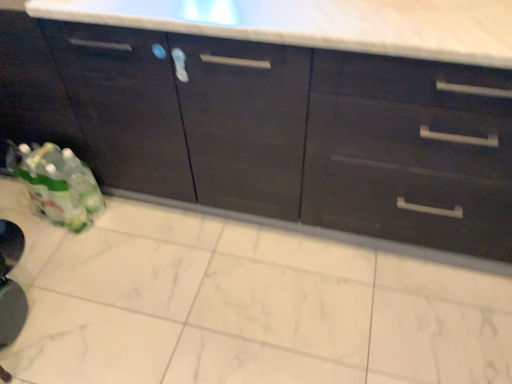
Question: Is point (109, 119) positioned closer to the camera than point (223, 69)?

Choices:
 (A) closer
 (B) farther

Answer: (B)

Question: Relative to matte dark wood cabinets at center, positioned as the second cabinetry in left-to-right order, is matte black cabinet at lower left, which is the first cabinetry from left to right, in front or behind?

Choices:
 (A) behind
 (B) front

Answer: (A)

Question: From a real-world perspective, is matte black cabinet at lower left, which is the second cabinetry from right to left, above or below matte dark wood cabinets at center, positioned as the second cabinetry in left-to-right order?

Choices:
 (A) below
 (B) above

Answer: (B)

Question: From the image's perspective, relative to matte black cabinet at lower left, which is the first cabinetry from left to right, is matte dark wood cabinets at center, positioned as the second cabinetry in left-to-right order, above or below?

Choices:
 (A) below
 (B) above

Answer: (A)

Question: In terms of height, does matte dark wood cabinets at center, acting as the first cabinetry starting from the right, look taller or shorter compared to matte black cabinet at lower left, which is the second cabinetry from right to left?

Choices:
 (A) tall
 (B) short

Answer: (A)

Question: Visually, is matte dark wood cabinets at center, acting as the first cabinetry starting from the right, positioned to the left or to the right of matte black cabinet at lower left, which is the first cabinetry from left to right?

Choices:
 (A) right
 (B) left

Answer: (A)

Question: In terms of size, does matte dark wood cabinets at center, positioned as the second cabinetry in left-to-right order, appear bigger or smaller than matte black cabinet at lower left, which is the first cabinetry from left to right?

Choices:
 (A) small
 (B) big

Answer: (B)